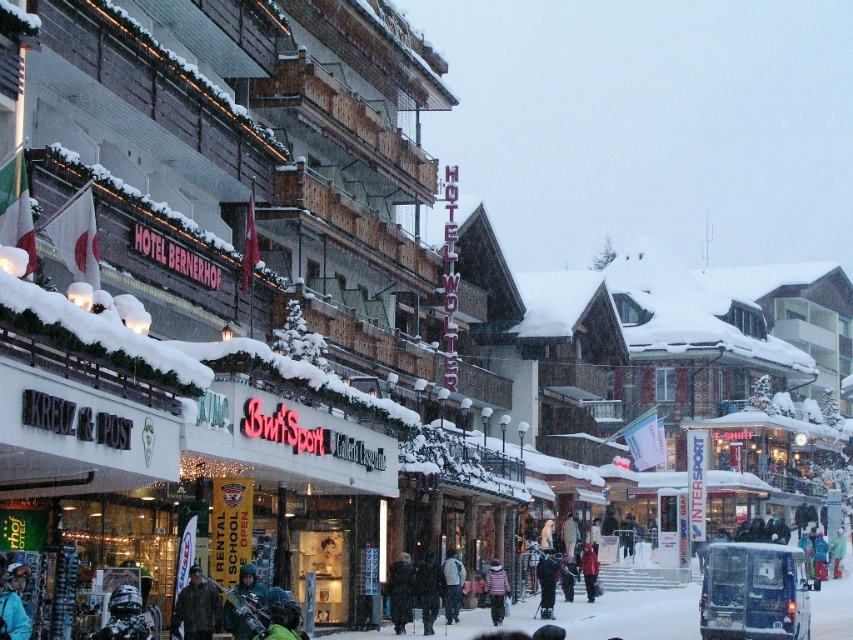
Question: Which point appears farthest from the camera in this image?

Choices:
 (A) (503, 596)
 (B) (582, 573)
 (C) (212, 595)
 (D) (447, 554)

Answer: (B)

Question: Can you confirm if blue fabric jacket at lower left is positioned above dark gray wool coat at center?

Choices:
 (A) no
 (B) yes

Answer: (B)

Question: Considering the real-world distances, which object is closest to the dark brown leather jacket at center?

Choices:
 (A) matte black ski equipment at center
 (B) black fur coat at center

Answer: (A)

Question: Does dark brown leather jacket at center have a smaller size compared to blue fabric jacket at lower left?

Choices:
 (A) yes
 (B) no

Answer: (B)

Question: Does matte black ski equipment at center have a lesser width compared to blue fabric jacket at lower left?

Choices:
 (A) yes
 (B) no

Answer: (B)

Question: Which object appears closest to the camera in this image?

Choices:
 (A) matte black ski equipment at center
 (B) blue fabric jacket at lower left

Answer: (B)